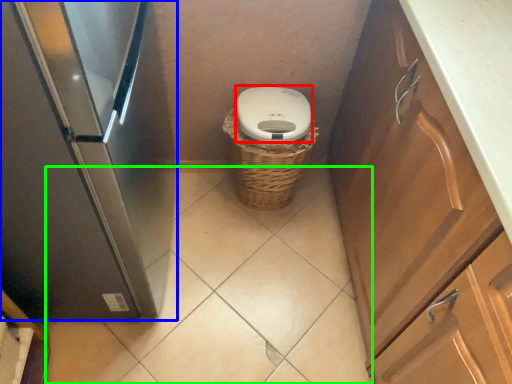
Question: Which object is the farthest from toilet bowl (highlighted by a red box)? Choose among these: home appliance (highlighted by a blue box) or plain (highlighted by a green box).

Choices:
 (A) home appliance
 (B) plain

Answer: (B)